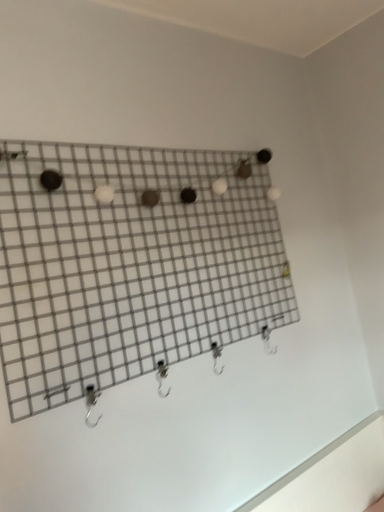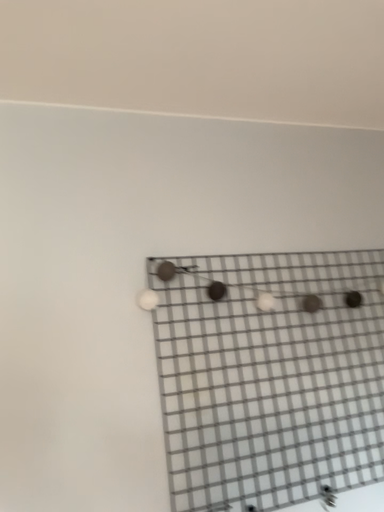
Question: How did the camera likely rotate when shooting the video?

Choices:
 (A) rotated right
 (B) rotated left

Answer: (B)